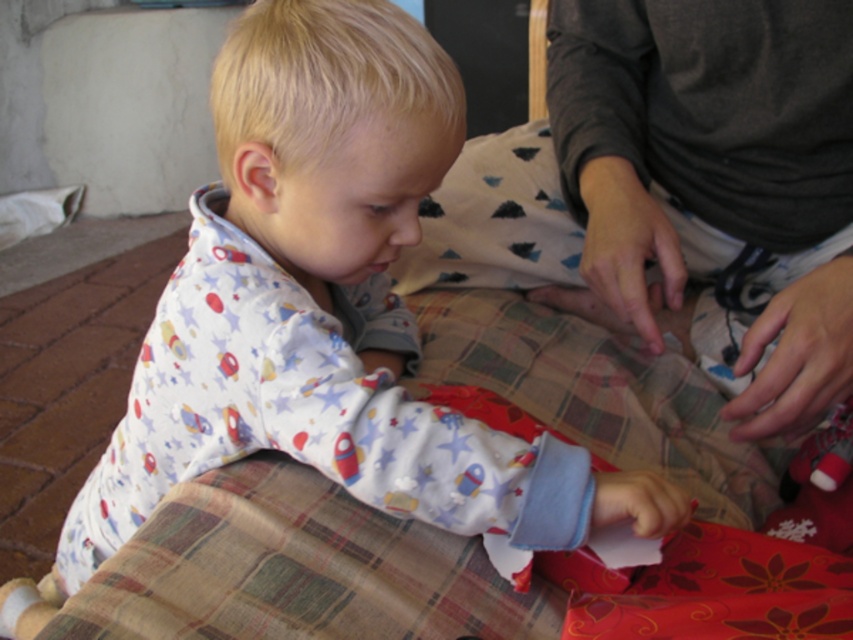
You are a parent trying to dress your child who is currently lying on a bed. You notice the white cotton pajamas at center and the dark gray fabric at center. Which item is closer to the child?

The white cotton pajamas at center is positioned under the dark gray fabric at center, so the dark gray fabric at center is closer to the child.